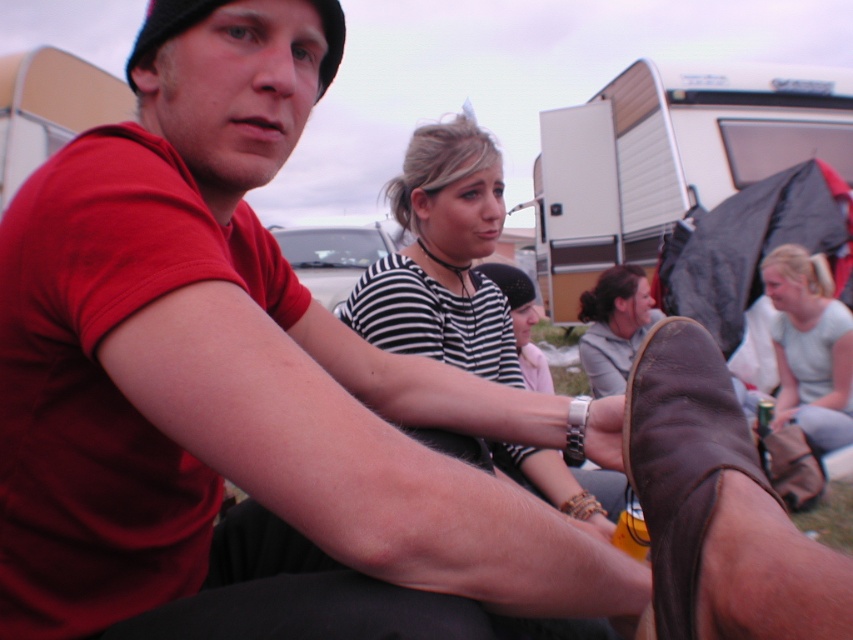
Question: Does brown leather shoe at lower right appear over gray fabric jacket at lower right?

Choices:
 (A) no
 (B) yes

Answer: (A)

Question: From the image, what is the correct spatial relationship of brown leather shoe at lower right in relation to light gray cotton shirt at lower right?

Choices:
 (A) left
 (B) right

Answer: (A)

Question: Among these objects, which one is farthest from the camera?

Choices:
 (A) striped fabric shirt at center
 (B) light gray cotton shirt at lower right

Answer: (B)

Question: Which point is closer to the camera?

Choices:
 (A) striped fabric shirt at center
 (B) gray fabric jacket at lower right
 (C) light gray cotton shirt at lower right
 (D) brown leather shoe at lower right

Answer: (D)

Question: Which of the following is the closest to the observer?

Choices:
 (A) gray fabric jacket at lower right
 (B) brown leather shoe at lower right

Answer: (B)

Question: From the image, what is the correct spatial relationship of striped fabric shirt at center in relation to gray fabric jacket at lower right?

Choices:
 (A) above
 (B) below

Answer: (A)